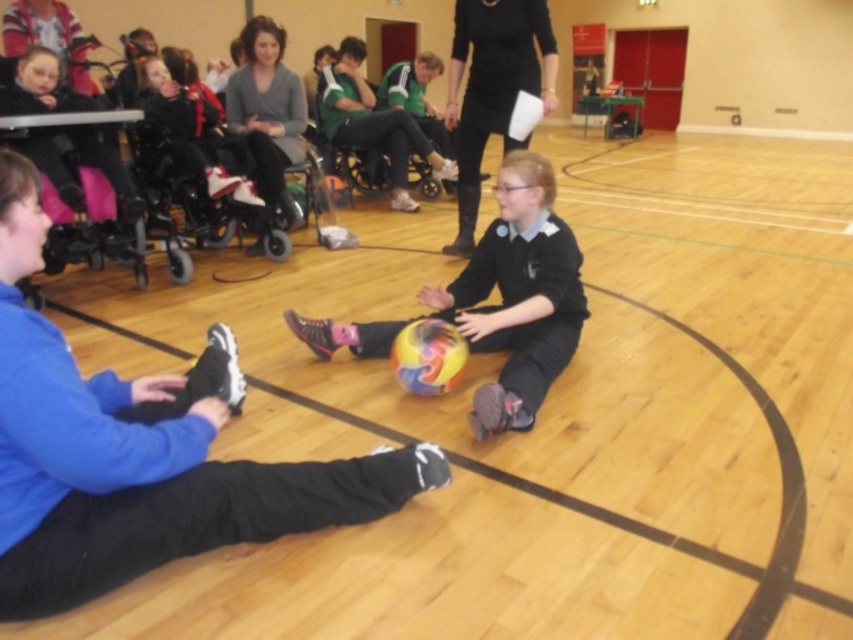
You are a photographer setting up for an event in the gymnasium. You need to position a camera on a tripod so that both the multicolored rubber ball at center and the matte black wheelchair at upper left are in frame. Considering their heights, which object will appear larger in the photo?

The multicolored rubber ball at center will appear larger in the photo because it is much taller than the matte black wheelchair at upper left.

You are a photographer positioned at the entrance of the gymnasium. You need to capture a photo where both the multicolored rubber ball at center and the black matte dress at center are visible. Based on their positions, which object should you ensure is closer to the left side of your frame?

The multicolored rubber ball at center is to the left of the black matte dress at center, so you should ensure the multicolored rubber ball at center is closer to the left side of your frame to include both in the photo.

You are a photographer setting up for a group photo in the gymnasium. You need to ensure that the multicolored rubber ball at center and the black matte dress at center are both visible in the shot. Based on their heights, which object should be placed closer to the camera to ensure both are fully visible?

The multicolored rubber ball at center is shorter than the black matte dress at center. To ensure both are fully visible, the multicolored rubber ball at center should be placed closer to the camera so it doesn